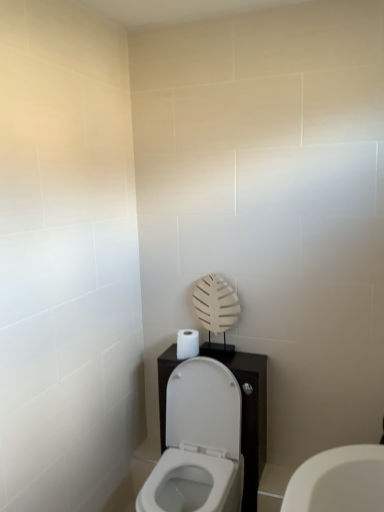
What are the coordinates of `white matte toilet paper at center` in the screenshot? It's located at (187, 343).

Describe the element at coordinates (187, 343) in the screenshot. I see `white matte toilet paper at center` at that location.

Describe the element at coordinates (199, 443) in the screenshot. The width and height of the screenshot is (384, 512). I see `white glossy toilet at center` at that location.

Measure the distance between white glossy toilet at center and camera.

white glossy toilet at center is 1.76 meters from camera.

This screenshot has height=512, width=384. I want to click on white glossy toilet at center, so coord(199,443).

This screenshot has width=384, height=512. What are the coordinates of `white matte toilet paper at center` in the screenshot? It's located at [x=187, y=343].

Based on the photo, is white glossy toilet at center at the left side of white matte toilet paper at center?

In fact, white glossy toilet at center is to the right of white matte toilet paper at center.

Which is in front, white glossy toilet at center or white matte toilet paper at center?

white glossy toilet at center is more forward.

Is point (185, 364) closer to camera compared to point (193, 344)?

Yes, point (185, 364) is in front of point (193, 344).

From the image's perspective, is white glossy toilet at center located above or below white matte toilet paper at center?

white glossy toilet at center is situated lower than white matte toilet paper at center in the image.

From a real-world perspective, who is located lower, white glossy toilet at center or white matte toilet paper at center?

white glossy toilet at center, from a real-world perspective.

Considering the sizes of white glossy toilet at center and white matte toilet paper at center in the image, is white glossy toilet at center wider or thinner than white matte toilet paper at center?

Clearly, white glossy toilet at center has more width compared to white matte toilet paper at center.

Between white glossy toilet at center and white matte toilet paper at center, which one has more height?

white glossy toilet at center.

Between white glossy toilet at center and white matte toilet paper at center, which one has smaller size?

With smaller size is white matte toilet paper at center.

Is white matte toilet paper at center located within white glossy toilet at center?

No, white matte toilet paper at center is not a part of white glossy toilet at center.

Is white glossy toilet at center with white matte toilet paper at center?

white glossy toilet at center and white matte toilet paper at center are clearly separated.

In the scene shown: Is white glossy toilet at center looking in the opposite direction of white matte toilet paper at center?

white glossy toilet at center is not turned away from white matte toilet paper at center.

Image resolution: width=384 pixels, height=512 pixels. I want to click on toilet that is below the white matte toilet paper at center (from the image's perspective), so click(x=199, y=443).

Consider the image. Is white matte toilet paper at center to the right of white glossy toilet at center from the viewer's perspective?

No.

Which object is more forward, white matte toilet paper at center or white glossy toilet at center?

Positioned in front is white glossy toilet at center.

Does point (193, 348) come farther from viewer compared to point (199, 391)?

Yes, it is.

From the image's perspective, is white matte toilet paper at center located above or below white glossy toilet at center?

From the image's perspective, white matte toilet paper at center appears above white glossy toilet at center.

From a real-world perspective, does white matte toilet paper at center stand above white glossy toilet at center?

Yes, from a real-world perspective, white matte toilet paper at center is above white glossy toilet at center.

Is white matte toilet paper at center wider or thinner than white glossy toilet at center?

Clearly, white matte toilet paper at center has less width compared to white glossy toilet at center.

Who is shorter, white matte toilet paper at center or white glossy toilet at center?

white matte toilet paper at center is shorter.

Who is bigger, white matte toilet paper at center or white glossy toilet at center?

white glossy toilet at center is bigger.

Is white matte toilet paper at center inside the boundaries of white glossy toilet at center, or outside?

white matte toilet paper at center is outside white glossy toilet at center.

Is white matte toilet paper at center positioned far away from white glossy toilet at center?

white matte toilet paper at center is actually quite close to white glossy toilet at center.

Is white matte toilet paper at center positioned with its back to white glossy toilet at center?

No, white matte toilet paper at center is not facing the opposite direction of white glossy toilet at center.

At what (x,y) coordinates should I click in order to perform the action: click on toilet below the white matte toilet paper at center (from the image's perspective). Please return your answer as a coordinate pair (x, y). Looking at the image, I should click on (199, 443).

This screenshot has height=512, width=384. In order to click on toilet in front of the white matte toilet paper at center in this screenshot , I will do `click(199, 443)`.

This screenshot has width=384, height=512. I want to click on toilet below the white matte toilet paper at center (from the image's perspective), so click(199, 443).